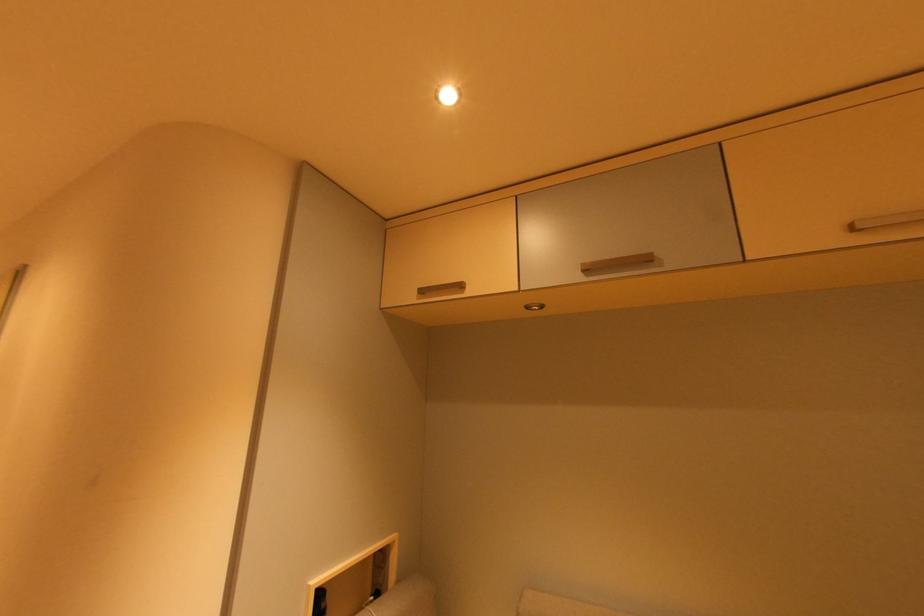
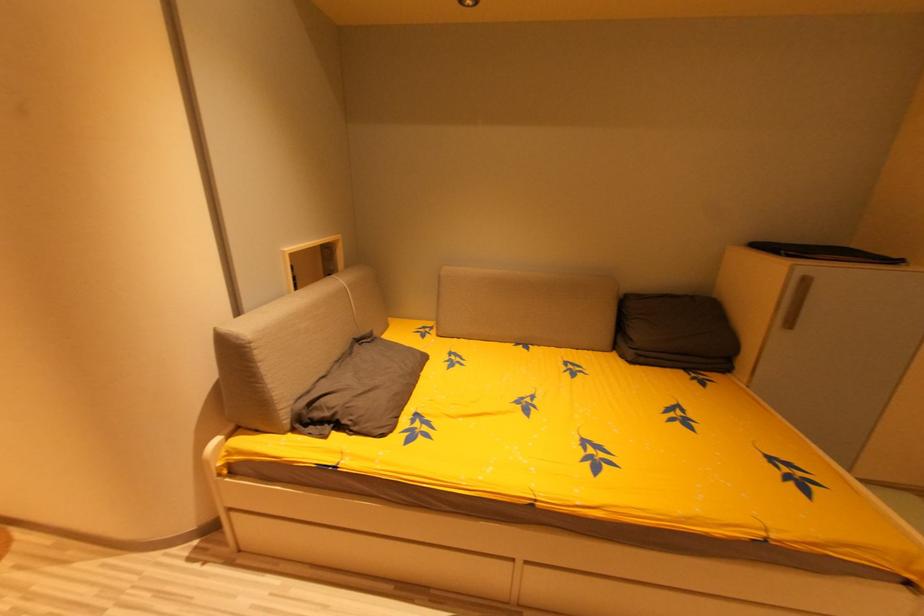
Based on the continuous images, in which direction is the camera rotating?

The camera rotated toward right-down.